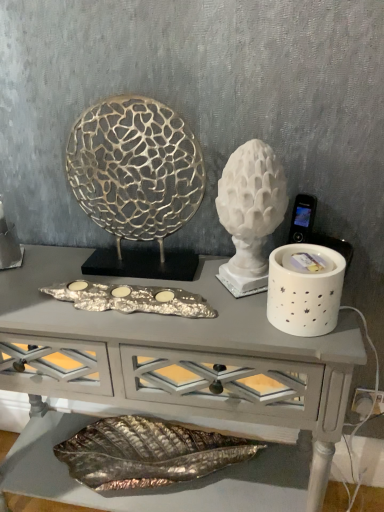
What are the coordinates of `free space in front of white marble sculpture at center, which appears as the first sculpture when viewed from the right` in the screenshot? It's located at (246, 329).